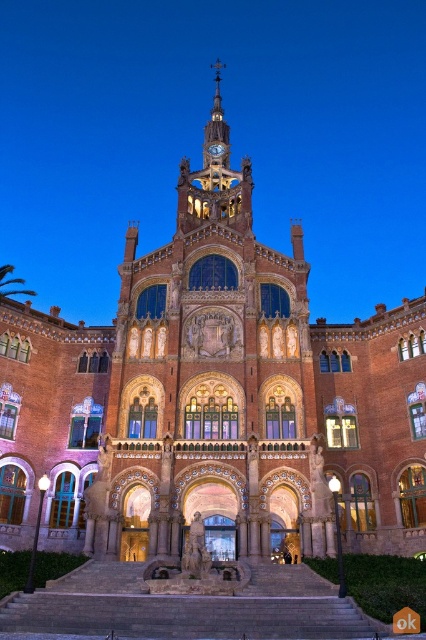
Question: Considering the relative positions of golden ornate clock tower at upper center and gold metallic clock at upper center in the image provided, where is golden ornate clock tower at upper center located with respect to gold metallic clock at upper center?

Choices:
 (A) left
 (B) right

Answer: (A)

Question: Which object appears farthest from the camera in this image?

Choices:
 (A) golden ornate clock tower at upper center
 (B) gold metallic clock at upper center

Answer: (B)

Question: Does golden ornate clock tower at upper center have a larger size compared to gold metallic clock at upper center?

Choices:
 (A) yes
 (B) no

Answer: (A)

Question: Which of the following is the farthest from the observer?

Choices:
 (A) golden ornate clock tower at upper center
 (B) gold metallic clock at upper center

Answer: (B)

Question: Is golden ornate clock tower at upper center in front of gold metallic clock at upper center?

Choices:
 (A) no
 (B) yes

Answer: (B)